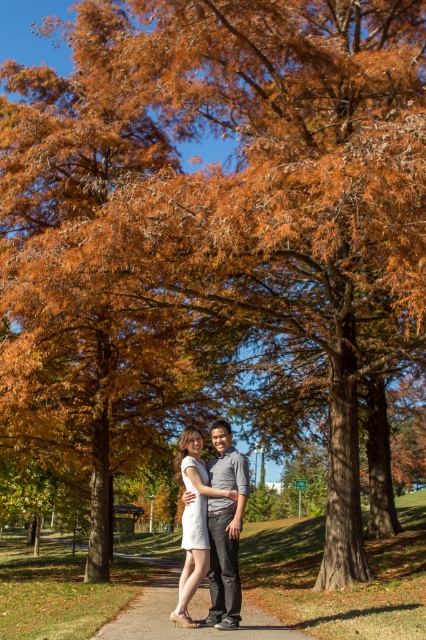
Question: In this image, where is gray cotton shirt at center located relative to white matte dress at center?

Choices:
 (A) right
 (B) left

Answer: (A)

Question: Which of the following is the closest to the observer?

Choices:
 (A) gray cotton shirt at center
 (B) brown gravel path at center

Answer: (B)

Question: Among these objects, which one is nearest to the camera?

Choices:
 (A) gray cotton shirt at center
 (B) brown gravel path at center
 (C) white matte dress at center

Answer: (B)

Question: Which of the following is the closest to the observer?

Choices:
 (A) (192, 435)
 (B) (178, 636)

Answer: (B)

Question: Does brown gravel path at center come in front of gray cotton shirt at center?

Choices:
 (A) yes
 (B) no

Answer: (A)

Question: Can you confirm if brown gravel path at center is thinner than white matte dress at center?

Choices:
 (A) yes
 (B) no

Answer: (B)